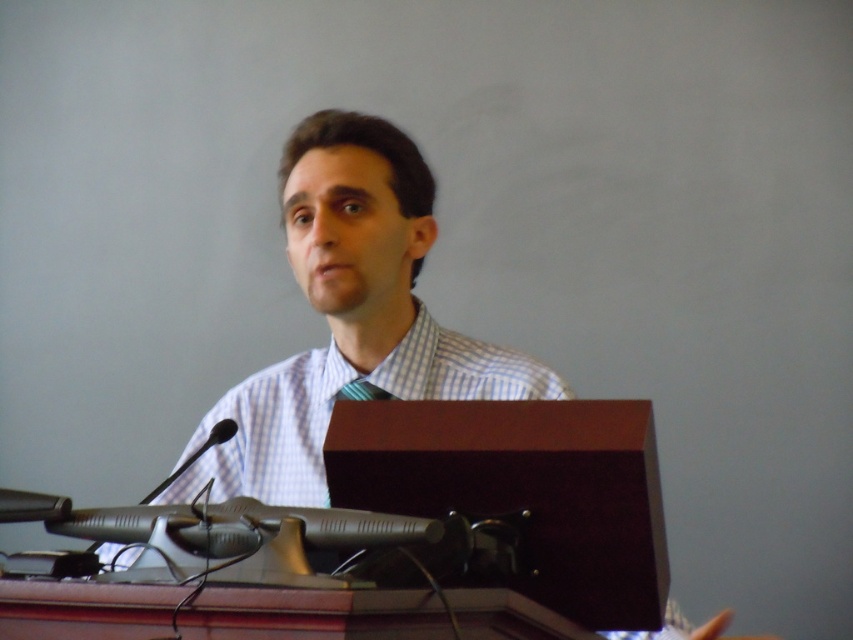
Is white checkered shirt at center below metallic silver microphone at left?

No, white checkered shirt at center is not below metallic silver microphone at left.

Which is above, white checkered shirt at center or metallic silver microphone at left?

white checkered shirt at center is higher up.

This screenshot has width=853, height=640. What do you see at coordinates (349, 316) in the screenshot?
I see `white checkered shirt at center` at bounding box center [349, 316].

Locate an element on the screen. This screenshot has height=640, width=853. white checkered shirt at center is located at coordinates (349, 316).